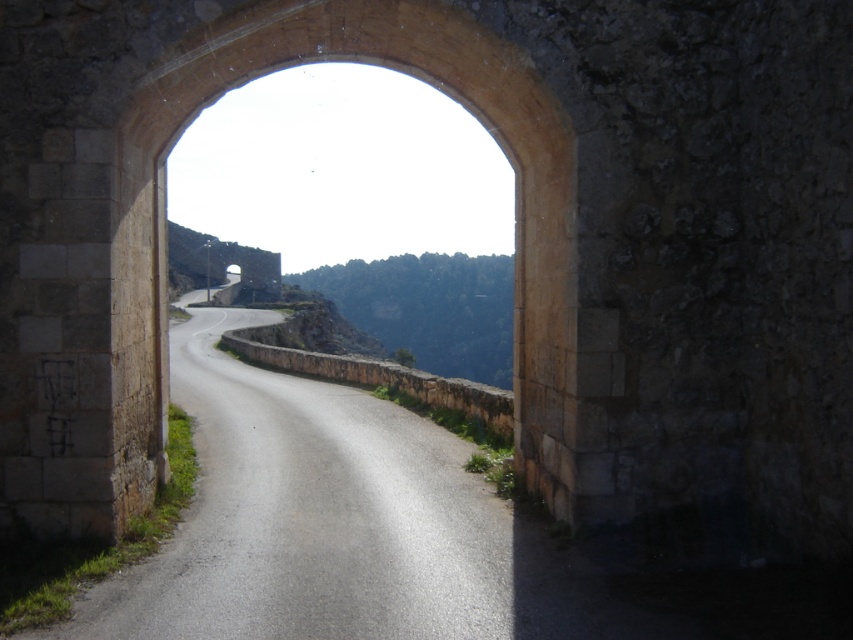
Question: Where is asphalt road at center located in relation to brown stone archway at center in the image?

Choices:
 (A) below
 (B) above

Answer: (A)

Question: Which of the following is the closest to the observer?

Choices:
 (A) (550, 227)
 (B) (321, 566)

Answer: (B)

Question: Is asphalt road at center to the left of brown stone archway at center from the viewer's perspective?

Choices:
 (A) no
 (B) yes

Answer: (B)

Question: Does asphalt road at center appear on the left side of brown stone archway at center?

Choices:
 (A) yes
 (B) no

Answer: (A)

Question: Among these objects, which one is nearest to the camera?

Choices:
 (A) asphalt road at center
 (B) brown stone archway at center

Answer: (A)

Question: Which of the following is the farthest from the observer?

Choices:
 (A) asphalt road at center
 (B) brown stone archway at center

Answer: (B)